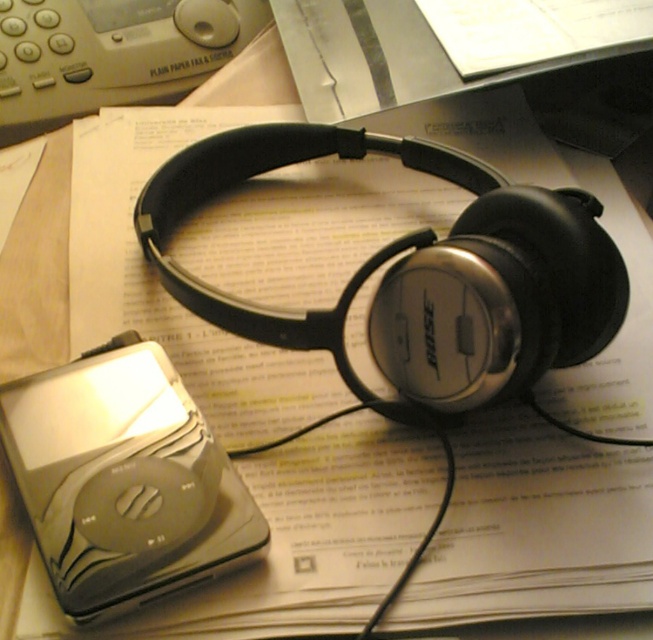
Who is shorter, satin silver headphones at center or satin silver ipod at center?

With less height is satin silver ipod at center.

Can you confirm if satin silver headphones at center is taller than satin silver ipod at center?

Correct, satin silver headphones at center is much taller as satin silver ipod at center.

Between point (535, 305) and point (210, 468), which one is positioned in front?

Point (535, 305)

The height and width of the screenshot is (640, 653). Find the location of `satin silver headphones at center`. satin silver headphones at center is located at coordinates (419, 272).